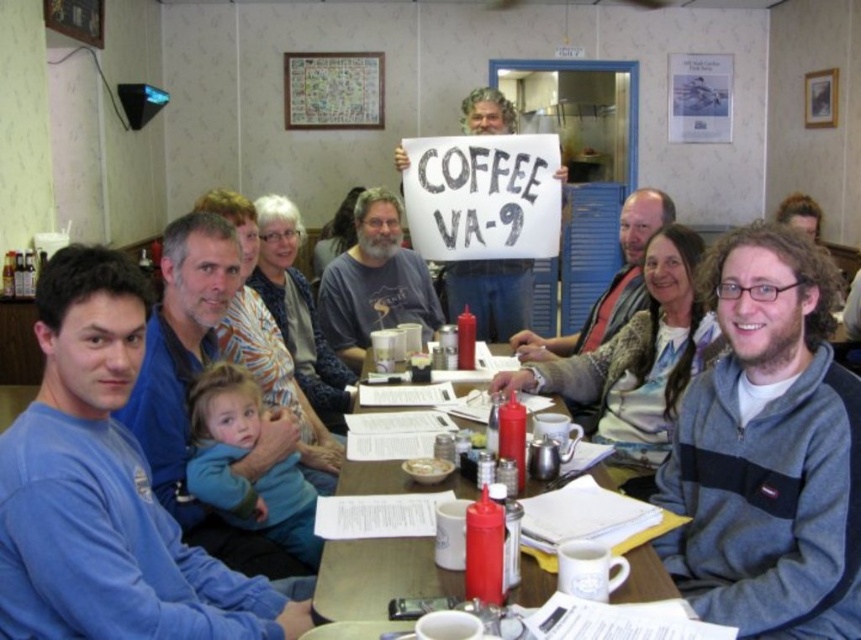
Question: Estimate the real-world distances between objects in this image. Which object is closer to the white paper sign at center?

Choices:
 (A) white matte bowl at center
 (B) wooden table at center
 (C) gray fleece jacket at center

Answer: (A)

Question: Can you confirm if gray fleece jacket at center is positioned to the right of blue cotton shirt at left?

Choices:
 (A) no
 (B) yes

Answer: (B)

Question: Where is gray fleece jacket at center located in relation to gray t-shirt at center in the image?

Choices:
 (A) above
 (B) below

Answer: (B)

Question: Which of the following is the farthest from the observer?

Choices:
 (A) white matte bowl at center
 (B) white paper sign at center
 (C) gray t-shirt at center

Answer: (B)

Question: Does wooden table at center lie behind gray sweater at center?

Choices:
 (A) no
 (B) yes

Answer: (A)

Question: Which object is farther from the camera taking this photo?

Choices:
 (A) gray t-shirt at center
 (B) gray sweater at center

Answer: (A)